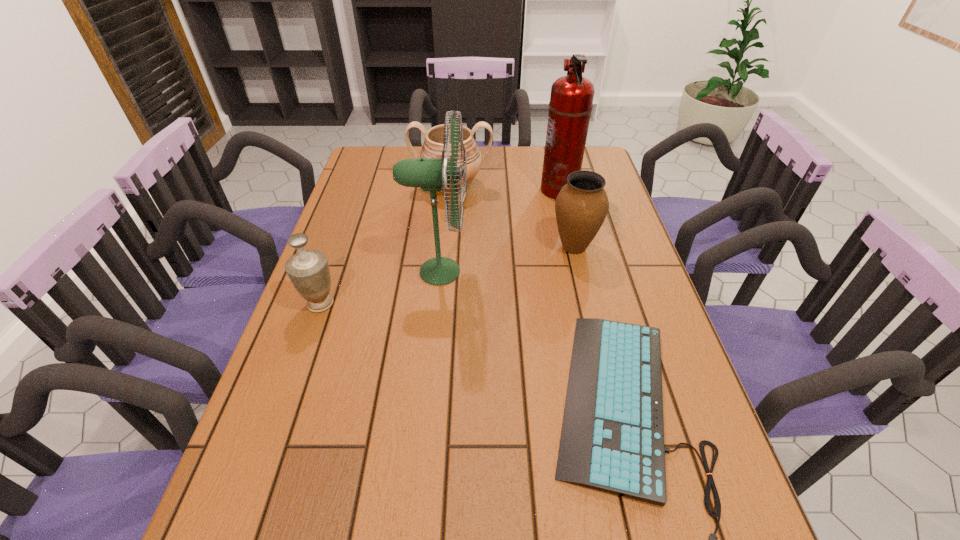
Locate an element on the screen. Image resolution: width=960 pixels, height=540 pixels. blank space at the left edge is located at coordinates (335, 241).

Where is `vacant space at the right edge of the desktop`? This screenshot has width=960, height=540. vacant space at the right edge of the desktop is located at coordinates (609, 255).

At what (x,y) coordinates should I click in order to perform the action: click on vacant region between the fan and the leftmost object. Please return your answer as a coordinate pair (x, y). The width and height of the screenshot is (960, 540). Looking at the image, I should click on (379, 287).

Find the location of a particular element. empty space that is in between the fan and the leftmost object is located at coordinates (379, 287).

Identify the location of free space between the second urn from right to left and the second farthest urn. This screenshot has width=960, height=540. (513, 217).

Where is `vacant area that lies between the rightmost urn and the fan`? vacant area that lies between the rightmost urn and the fan is located at coordinates coord(506,259).

This screenshot has width=960, height=540. What are the coordinates of `free space that is in between the fire extinguisher and the second urn from left to right` in the screenshot? It's located at (505, 187).

The width and height of the screenshot is (960, 540). Identify the location of free space between the farthest urn and the leftmost object. (386, 245).

What are the coordinates of `vacant space in between the fire extinguisher and the fan` in the screenshot? It's located at (498, 231).

Point out which object is positioned as the fifth nearest to the farthest urn. Please provide its 2D coordinates. Your answer should be formatted as a tuple, i.e. [(x, y)], where the tuple contains the x and y coordinates of a point satisfying the conditions above.

[(612, 440)]